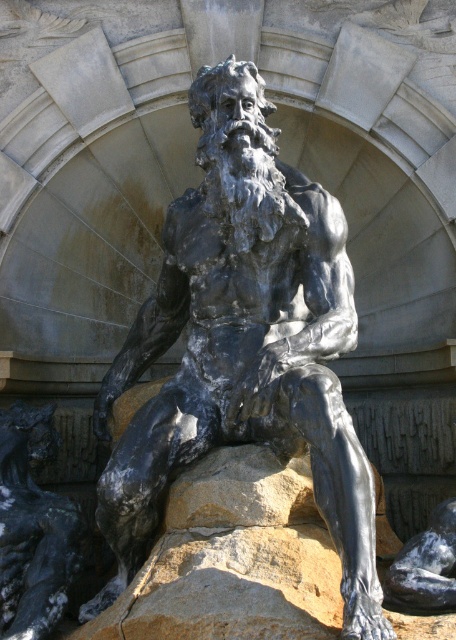
Who is higher up, shiny bronze statue at center or shiny black stone statue at center?

shiny bronze statue at center is above.

Where is `shiny bronze statue at center`? This screenshot has width=456, height=640. shiny bronze statue at center is located at coordinates point(243,342).

The width and height of the screenshot is (456, 640). I want to click on shiny bronze statue at center, so click(x=243, y=342).

Between shiny bronze statue at center and shiny black stone figure at lower left, which one appears on the left side from the viewer's perspective?

Positioned to the left is shiny black stone figure at lower left.

Who is shorter, shiny bronze statue at center or shiny black stone figure at lower left?

shiny black stone figure at lower left

What do you see at coordinates (243, 342) in the screenshot? I see `shiny bronze statue at center` at bounding box center [243, 342].

Locate an element on the screen. The width and height of the screenshot is (456, 640). shiny bronze statue at center is located at coordinates (243, 342).

Does shiny black stone figure at lower left have a smaller size compared to shiny black stone statue at center?

No, shiny black stone figure at lower left is not smaller than shiny black stone statue at center.

Is shiny black stone figure at lower left wider than shiny black stone statue at center?

Correct, the width of shiny black stone figure at lower left exceeds that of shiny black stone statue at center.

Is point (25, 608) more distant than point (452, 509)?

No, (25, 608) is closer to viewer.

Locate an element on the screen. This screenshot has height=640, width=456. shiny black stone figure at lower left is located at coordinates (34, 529).